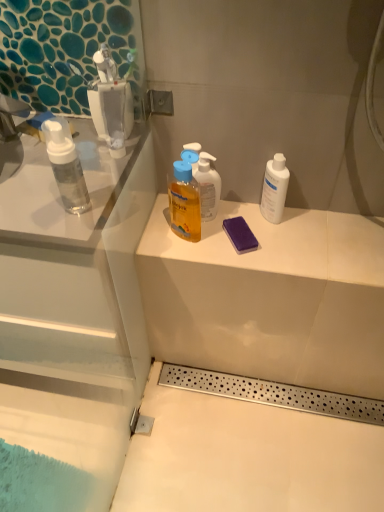
This screenshot has width=384, height=512. I want to click on free space to the right of translucent yellow liquid at upper center, so click(x=249, y=237).